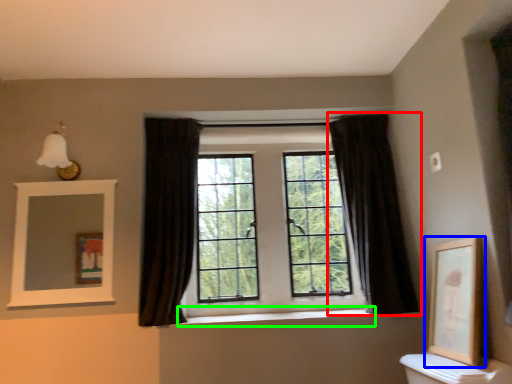
Question: Which object is positioned farthest from curtain (highlighted by a red box)? Select from picture frame (highlighted by a blue box) and window sill (highlighted by a green box).

Choices:
 (A) picture frame
 (B) window sill

Answer: (B)